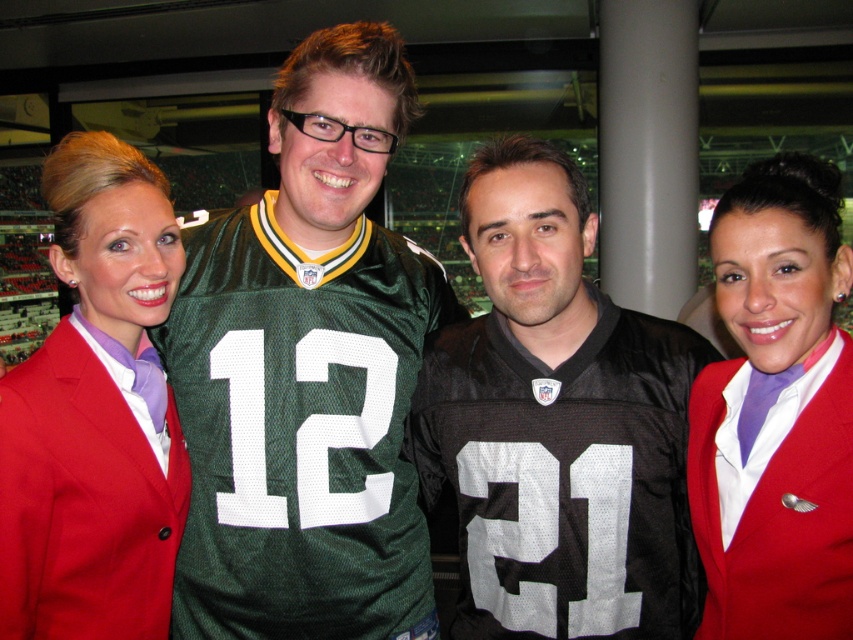
You are standing at the point with coordinates point (161, 456) and want to move to the point with coordinates point (700, 477). Is the point you want to go to in front of or behind you?

The point you want to go to, point (700, 477), is in front of you because point (161, 456) is behind point (700, 477).

You are a photographer who needs to adjust the lighting to ensure both the green jersey at center and the matte red blazer at center are equally visible. Considering their sizes, which one might require more focused lighting adjustments?

The green jersey at center is bigger than the matte red blazer at center. Since the green jersey is larger, it might require more focused lighting adjustments to ensure it doesn

From the picture: You are a photographer trying to adjust the framing of the photo. The black jersey at center and the matte red blazer at center are both in the center of the image. Which one is taller?

The black jersey at center is much taller than the matte red blazer at center according to the description.